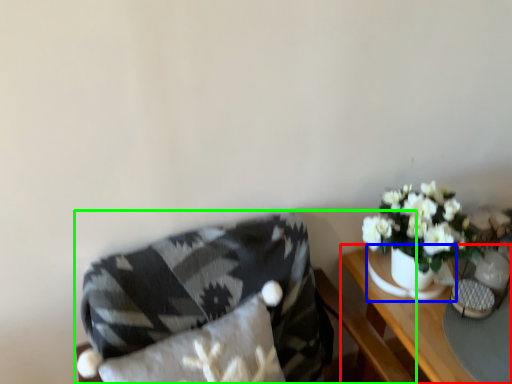
Question: Considering the real-world distances, which object is closest to table (highlighted by a red box)? vase (highlighted by a blue box) or chair (highlighted by a green box).

Choices:
 (A) vase
 (B) chair

Answer: (A)